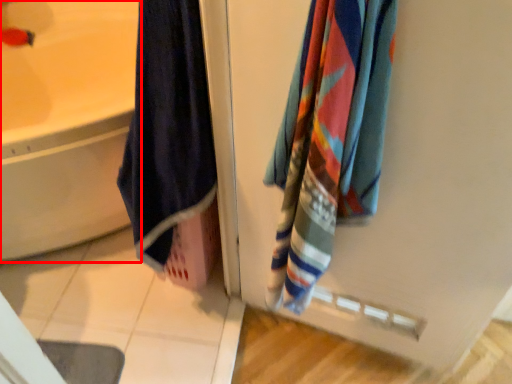
Question: Where is bathtub (annotated by the red box) located in relation to towel in the image?

Choices:
 (A) left
 (B) right

Answer: (A)